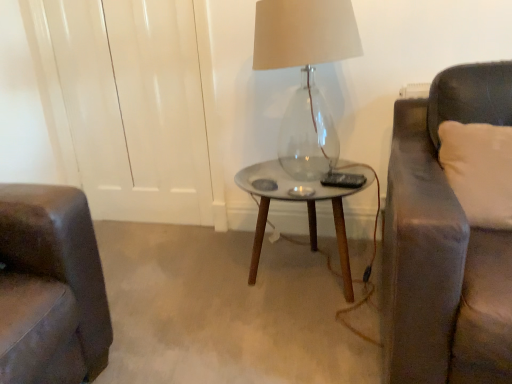
Question: Considering the relative sizes of white soft cushion at right and translucent glass lamp at center in the image provided, is white soft cushion at right bigger than translucent glass lamp at center?

Choices:
 (A) no
 (B) yes

Answer: (A)

Question: Is white soft cushion at right oriented towards translucent glass lamp at center?

Choices:
 (A) no
 (B) yes

Answer: (A)

Question: Would you consider white soft cushion at right to be distant from translucent glass lamp at center?

Choices:
 (A) yes
 (B) no

Answer: (B)

Question: From the image's perspective, is white soft cushion at right on top of translucent glass lamp at center?

Choices:
 (A) yes
 (B) no

Answer: (B)

Question: From a real-world perspective, is white soft cushion at right over translucent glass lamp at center?

Choices:
 (A) no
 (B) yes

Answer: (A)

Question: In terms of width, does metallic silver table at center look wider or thinner when compared to translucent glass lamp at center?

Choices:
 (A) thin
 (B) wide

Answer: (B)

Question: In terms of size, does metallic silver table at center appear bigger or smaller than translucent glass lamp at center?

Choices:
 (A) small
 (B) big

Answer: (B)

Question: Is point (342, 190) positioned closer to the camera than point (335, 46)?

Choices:
 (A) farther
 (B) closer

Answer: (A)

Question: In the image, is metallic silver table at center on the left side or the right side of translucent glass lamp at center?

Choices:
 (A) right
 (B) left

Answer: (A)

Question: Considering the positions of translucent glass lamp at center and metallic silver table at center in the image, is translucent glass lamp at center taller or shorter than metallic silver table at center?

Choices:
 (A) tall
 (B) short

Answer: (A)

Question: From a real-world perspective, relative to metallic silver table at center, is translucent glass lamp at center vertically above or below?

Choices:
 (A) above
 (B) below

Answer: (A)

Question: Considering the relative positions of translucent glass lamp at center and metallic silver table at center in the image provided, is translucent glass lamp at center to the left or to the right of metallic silver table at center?

Choices:
 (A) right
 (B) left

Answer: (B)

Question: In terms of width, does translucent glass lamp at center look wider or thinner when compared to metallic silver table at center?

Choices:
 (A) thin
 (B) wide

Answer: (A)

Question: From a real-world perspective, is translucent glass lamp at center physically located above or below white soft cushion at right?

Choices:
 (A) above
 (B) below

Answer: (A)

Question: Is translucent glass lamp at center spatially inside white soft cushion at right, or outside of it?

Choices:
 (A) outside
 (B) inside

Answer: (A)